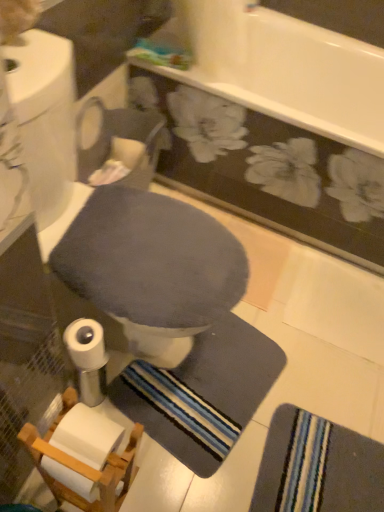
Question: Is striped fabric bath towel at lower right wider than dark gray fabric toilet bowl at center?

Choices:
 (A) yes
 (B) no

Answer: (B)

Question: From the image's perspective, is striped fabric bath towel at lower right above dark gray fabric toilet bowl at center?

Choices:
 (A) no
 (B) yes

Answer: (A)

Question: Is the depth of striped fabric bath towel at lower right greater than that of dark gray fabric toilet bowl at center?

Choices:
 (A) yes
 (B) no

Answer: (A)

Question: Is striped fabric bath towel at lower right oriented towards dark gray fabric toilet bowl at center?

Choices:
 (A) no
 (B) yes

Answer: (A)

Question: Are striped fabric bath towel at lower right and dark gray fabric toilet bowl at center making contact?

Choices:
 (A) yes
 (B) no

Answer: (B)

Question: Can you confirm if striped fabric bath towel at lower right is positioned to the right of dark gray fabric toilet bowl at center?

Choices:
 (A) yes
 (B) no

Answer: (A)

Question: Is dark gray fabric toilet bowl at center not close to striped fabric bath towel at lower right?

Choices:
 (A) no
 (B) yes

Answer: (A)

Question: From the image's perspective, would you say dark gray fabric toilet bowl at center is shown under striped fabric bath towel at lower right?

Choices:
 (A) yes
 (B) no

Answer: (B)

Question: Does dark gray fabric toilet bowl at center appear on the left side of striped fabric bath towel at lower right?

Choices:
 (A) no
 (B) yes

Answer: (B)

Question: Is dark gray fabric toilet bowl at center bigger than striped fabric bath towel at lower right?

Choices:
 (A) yes
 (B) no

Answer: (A)

Question: From a real-world perspective, is dark gray fabric toilet bowl at center under striped fabric bath towel at lower right?

Choices:
 (A) yes
 (B) no

Answer: (B)

Question: Is dark gray fabric toilet bowl at center facing towards striped fabric bath towel at lower right?

Choices:
 (A) no
 (B) yes

Answer: (A)

Question: Considering the positions of dark gray fabric toilet bowl at center and striped fabric bath towel at lower right in the image, is dark gray fabric toilet bowl at center taller or shorter than striped fabric bath towel at lower right?

Choices:
 (A) short
 (B) tall

Answer: (B)